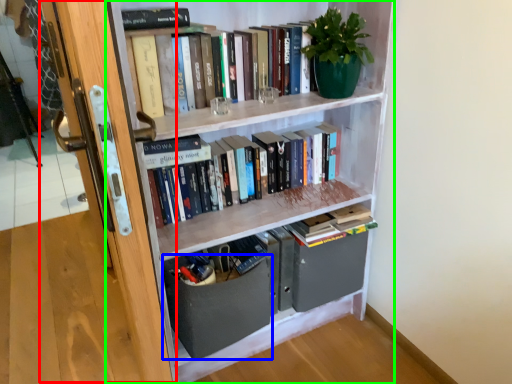
Question: Considering the real-world distances, which object is closest to glass door (highlighted by a red box)? drawer (highlighted by a blue box) or bookcase (highlighted by a green box).

Choices:
 (A) drawer
 (B) bookcase

Answer: (A)